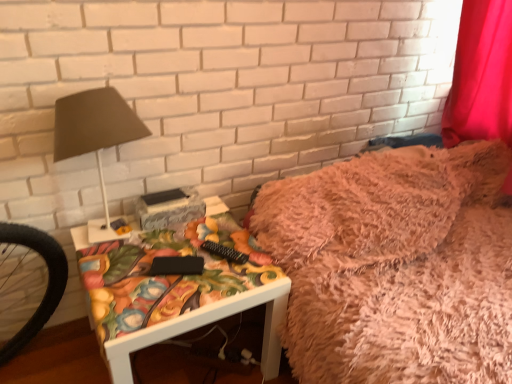
The image size is (512, 384). What are the coordinates of `matte brown lampshade at left` in the screenshot? It's located at (94, 127).

Locate an element on the screen. matte floral-patterned side table at center is located at coordinates (170, 296).

Which is behind, point (454, 270) or point (112, 145)?

The point (454, 270) is more distant.

From a real-world perspective, relative to matte brown lampshade at left, is fuzzy pink blanket at upper right vertically above or below?

Answer: fuzzy pink blanket at upper right is below matte brown lampshade at left.

Is fuzzy pink blanket at upper right beside matte brown lampshade at left?

No, fuzzy pink blanket at upper right is not beside matte brown lampshade at left.

Is fuzzy pink blanket at upper right to the right of matte brown lampshade at left from the viewer's perspective?

Correct, you'll find fuzzy pink blanket at upper right to the right of matte brown lampshade at left.

From the image's perspective, is fuzzy pink blanket at upper right located above or below matte floral-patterned side table at center?

From the image's perspective, fuzzy pink blanket at upper right appears above matte floral-patterned side table at center.

Is there a large distance between fuzzy pink blanket at upper right and matte floral-patterned side table at center?

That's not correct — fuzzy pink blanket at upper right is a little close to matte floral-patterned side table at center.

Would you say fuzzy pink blanket at upper right is outside matte floral-patterned side table at center?

That's correct, fuzzy pink blanket at upper right is outside of matte floral-patterned side table at center.

From a real-world perspective, is fuzzy pink blanket at upper right below matte floral-patterned side table at center?

No.

Is matte brown lampshade at left oriented towards matte floral-patterned side table at center?

No, matte brown lampshade at left is not facing towards matte floral-patterned side table at center.

Is matte brown lampshade at left touching matte floral-patterned side table at center?

No, matte brown lampshade at left is not in contact with matte floral-patterned side table at center.

From a real-world perspective, is matte brown lampshade at left physically below matte floral-patterned side table at center?

Incorrect, from a real-world perspective, matte brown lampshade at left is higher than matte floral-patterned side table at center.

Between matte brown lampshade at left and matte floral-patterned side table at center, which one appears on the left side from the viewer's perspective?

Positioned to the left is matte brown lampshade at left.

From the image's perspective, is matte floral-patterned side table at center under matte brown lampshade at left?

Yes.

Are matte floral-patterned side table at center and matte brown lampshade at left located far from each other?

No, there isn't a large distance between matte floral-patterned side table at center and matte brown lampshade at left.

Who is smaller, matte floral-patterned side table at center or matte brown lampshade at left?

matte brown lampshade at left is smaller.

Is matte floral-patterned side table at center aimed at matte brown lampshade at left?

No.

Which is behind, matte brown lampshade at left or fuzzy pink blanket at upper right?

Positioned behind is fuzzy pink blanket at upper right.

From a real-world perspective, is matte brown lampshade at left positioned above or below fuzzy pink blanket at upper right?

Clearly, from a real-world perspective, matte brown lampshade at left is above fuzzy pink blanket at upper right.

Considering the points (116, 121) and (367, 334), which point is behind, point (116, 121) or point (367, 334)?

The point (367, 334) is behind.

Are matte brown lampshade at left and fuzzy pink blanket at upper right making contact?

They are not placed beside each other.

Looking at this image, from a real-world perspective, between matte floral-patterned side table at center and fuzzy pink blanket at upper right, who is vertically higher?

fuzzy pink blanket at upper right, from a real-world perspective.

Is matte floral-patterned side table at center not near fuzzy pink blanket at upper right?

No, matte floral-patterned side table at center is in close proximity to fuzzy pink blanket at upper right.

From the image's perspective, which object appears higher, matte floral-patterned side table at center or fuzzy pink blanket at upper right?

fuzzy pink blanket at upper right.

This screenshot has height=384, width=512. Identify the location of table lamp in front of the fuzzy pink blanket at upper right. (94, 127).

Identify the location of bed that appears above the matte floral-patterned side table at center (from a real-world perspective). The width and height of the screenshot is (512, 384). (395, 266).

Which object lies further to the anchor point fuzzy pink blanket at upper right, matte brown lampshade at left or matte floral-patterned side table at center?

matte brown lampshade at left.

From the image, which object appears to be farther from matte brown lampshade at left, matte floral-patterned side table at center or fuzzy pink blanket at upper right?

Based on the image, fuzzy pink blanket at upper right appears to be further to matte brown lampshade at left.

Considering their positions, is matte floral-patterned side table at center positioned further to fuzzy pink blanket at upper right than matte brown lampshade at left?

Based on the image, matte brown lampshade at left appears to be further to fuzzy pink blanket at upper right.

Which object lies further to the anchor point matte floral-patterned side table at center, matte brown lampshade at left or fuzzy pink blanket at upper right?

matte brown lampshade at left.

From the image, which object appears to be farther from matte brown lampshade at left, fuzzy pink blanket at upper right or matte floral-patterned side table at center?

fuzzy pink blanket at upper right.

Considering their positions, is fuzzy pink blanket at upper right positioned further to matte floral-patterned side table at center than matte brown lampshade at left?

Among the two, matte brown lampshade at left is located further to matte floral-patterned side table at center.

This screenshot has height=384, width=512. In order to click on furniture located between matte brown lampshade at left and fuzzy pink blanket at upper right in the left-right direction in this screenshot , I will do `click(170, 296)`.